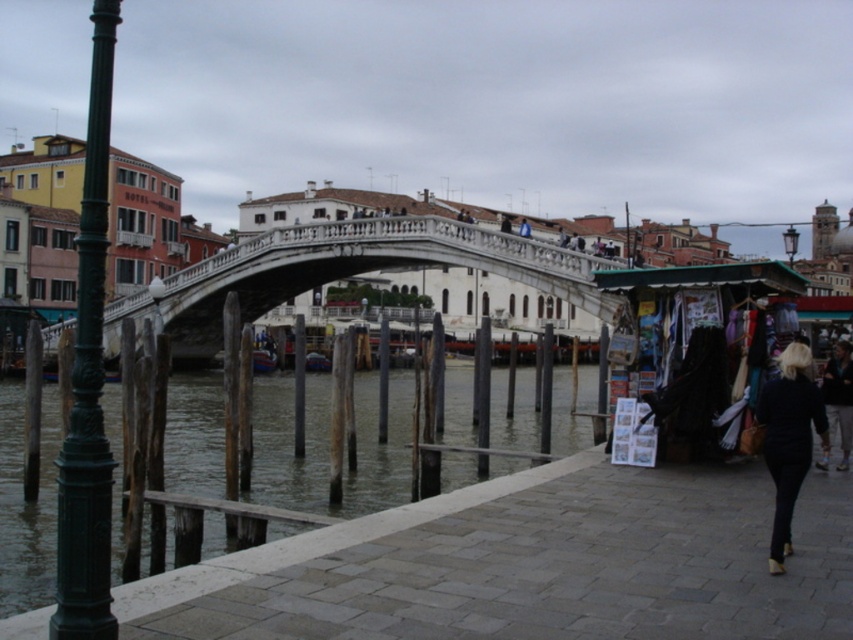
Question: Estimate the real-world distances between objects in this image. Which object is farther from the greenish water at lower left?

Choices:
 (A) dark blue jeans at lower right
 (B) blue fabric at center

Answer: (A)

Question: Can you confirm if white stone bridge at center is positioned to the right of dark blue jeans at lower right?

Choices:
 (A) no
 (B) yes

Answer: (A)

Question: Does black leather jacket at lower right appear on the left side of blue fabric at center?

Choices:
 (A) yes
 (B) no

Answer: (B)

Question: Which of the following is the closest to the observer?

Choices:
 (A) (527, 227)
 (B) (796, 467)
 (C) (405, 401)
 (D) (828, 388)

Answer: (B)

Question: Which point is closer to the camera?

Choices:
 (A) black leather jacket at lower right
 (B) dark blue jeans at lower right
 (C) greenish water at lower left

Answer: (A)

Question: Observing the image, what is the correct spatial positioning of greenish water at lower left in reference to white stone bridge at center?

Choices:
 (A) left
 (B) right

Answer: (B)